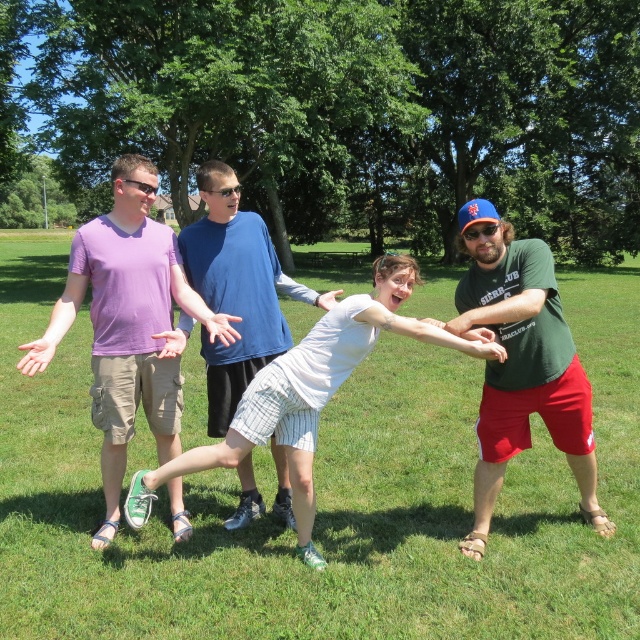
You are standing at the point with coordinates (324, 499) in the image. What is the object located at this point?

The point at coordinates (324, 499) corresponds to green grass at center.

You are a photographer positioned at the edge of the grassy field. You want to capture a photo where the white cotton shirt at center and the white striped shorts at center are both visible. Based on their heights, which one will appear taller in the photo?

The white cotton shirt at center has a lesser height compared to the white striped shorts at center, so the white striped shorts at center will appear taller in the photo.

You are standing in the park and see two people wearing white clothing at the center of the image. Which one is wearing the white cotton shirt at center? Is it to the left or right of the white striped shorts at center?

The white cotton shirt at center is to the right of the white striped shorts at center.